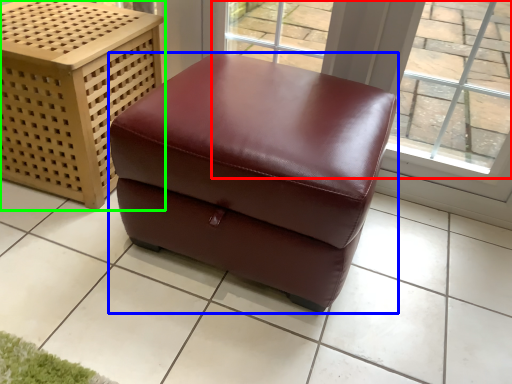
Question: Considering the real-world distances, which object is farthest from window (highlighted by a red box)? furniture (highlighted by a blue box) or furniture (highlighted by a green box)?

Choices:
 (A) furniture
 (B) furniture

Answer: (B)